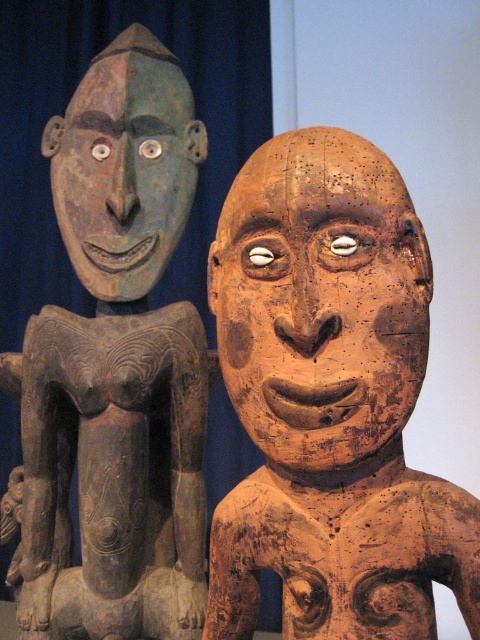
You are an art curator arranging an exhibition. You have two masks to display, the brown wooden mask at center and the matte green wood mask at upper left. Which mask should you place on the lower shelf if you want to follow the rule that shorter items go on lower shelves?

The brown wooden mask at center is shorter than the matte green wood mask at upper left, so it should be placed on the lower shelf according to the rule.

You are an art conservator examining the two points on the sculptures. Which point is closer to you, point (356, 168) or point (120, 145)?

Point (356, 168) is closer to the viewer than point (120, 145).

You are an art curator arranging an exhibition. You need to place a spotlight on the matte gray wood figure at left and the brown wooden mask at center. Which object should you place the spotlight above to ensure it shines on the object below it?

The matte gray wood figure at left is positioned under the brown wooden mask at center, so you should place the spotlight above the brown wooden mask at center to ensure it shines on the matte gray wood figure at left below it.